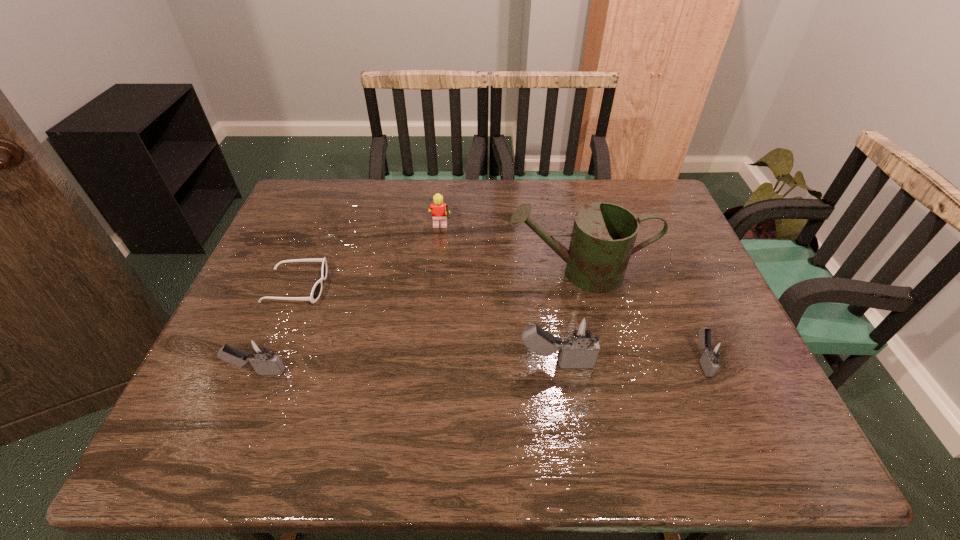
Image resolution: width=960 pixels, height=540 pixels. What are the coordinates of `free space in the image that satisfies the following two spatial constraints: 1. in front of the Lego with the accessory visible; 2. on the left side of the shortest igniter` in the screenshot? It's located at (427, 360).

The height and width of the screenshot is (540, 960). Identify the location of vacant position in the image that satisfies the following two spatial constraints: 1. with the spout on the rightmost igniter; 2. on the right side of the watering can. (598, 360).

This screenshot has width=960, height=540. I want to click on vacant space that satisfies the following two spatial constraints: 1. on the back side of the rightmost object; 2. on the left side of the second shortest igniter, so click(x=263, y=360).